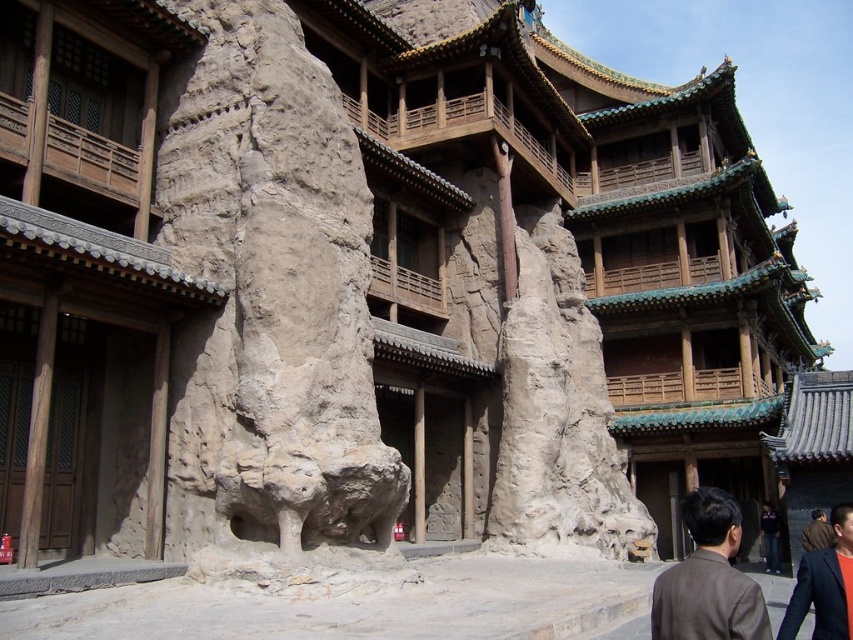
Is natural stone lion at center taller than brown matte jacket at lower right?

Yes.

Who is positioned more to the right, natural stone lion at center or brown matte jacket at lower right?

brown matte jacket at lower right is more to the right.

What are the coordinates of `natural stone lion at center` in the screenshot? It's located at (271, 296).

Who is positioned more to the left, brown woolen coat at lower right or brown leather jacket at lower right?

brown woolen coat at lower right is more to the left.

Between brown woolen coat at lower right and brown leather jacket at lower right, which one has less height?

Standing shorter between the two is brown leather jacket at lower right.

You are a GUI agent. You are given a task and a screenshot of the screen. Output one action in this format:
    pyautogui.click(x=<x>, y=<y>)
    Task: Click on the brown woolen coat at lower right
    The image size is (853, 640).
    Given the screenshot: What is the action you would take?
    pyautogui.click(x=824, y=584)

Who is more forward, (828, 632) or (767, 570)?

Point (828, 632) is more forward.

Between brown woolen coat at lower right and dark blue jeans at lower right, which one appears on the right side from the viewer's perspective?

From the viewer's perspective, dark blue jeans at lower right appears more on the right side.

Between point (817, 604) and point (770, 506), which one is positioned in front?

Positioned in front is point (817, 604).

Find the location of a particular element. brown woolen coat at lower right is located at coordinates (824, 584).